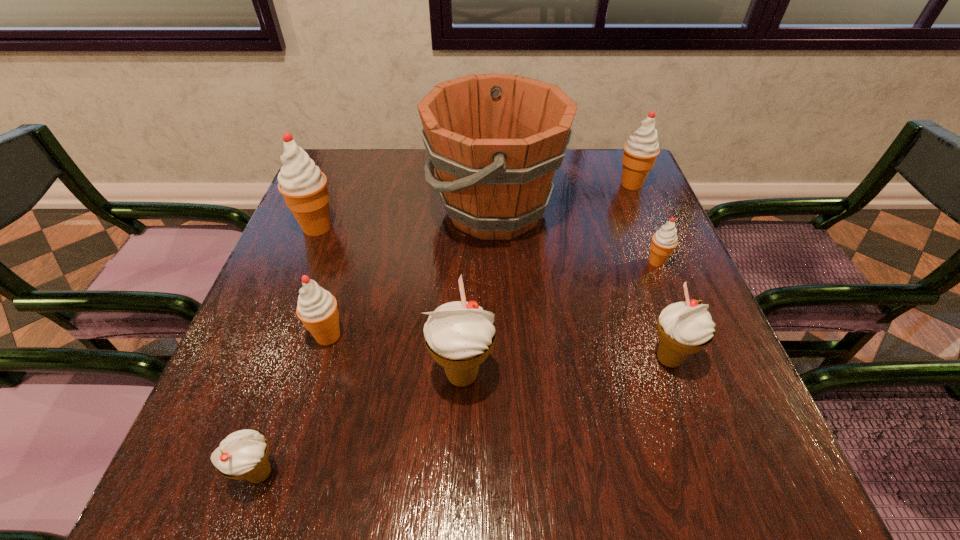
At what (x,y) coordinates should I click in order to perform the action: click on vacant position in the image that satisfies the following two spatial constraints: 1. on the front side of the farthest red icecream; 2. on the handle side of the bucket. Please return your answer as a coordinate pair (x, y). The height and width of the screenshot is (540, 960). Looking at the image, I should click on (642, 210).